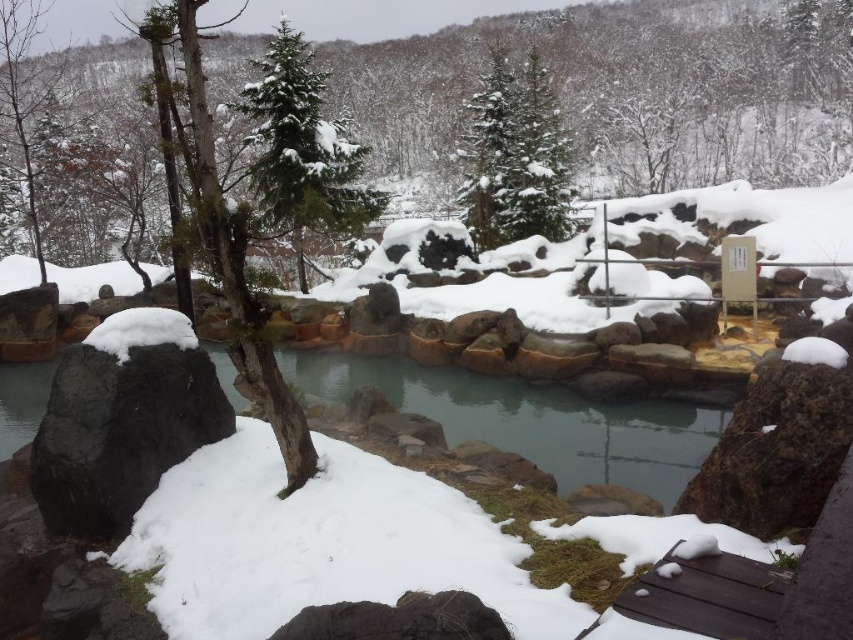
Question: Does clear water at center appear on the left side of green textured evergreen tree at upper center?

Choices:
 (A) no
 (B) yes

Answer: (B)

Question: Is green textured pine tree at upper center smaller than green textured evergreen tree at upper center?

Choices:
 (A) yes
 (B) no

Answer: (B)

Question: Is green textured pine tree at upper center smaller than green textured evergreen tree at upper center?

Choices:
 (A) no
 (B) yes

Answer: (A)

Question: Which of the following is the closest to the observer?

Choices:
 (A) (582, 426)
 (B) (251, 184)

Answer: (A)

Question: Which is farther from the clear water at center?

Choices:
 (A) green textured evergreen tree at upper center
 (B) green textured pine tree at upper center

Answer: (A)

Question: Estimate the real-world distances between objects in this image. Which object is farther from the green textured pine tree at upper center?

Choices:
 (A) clear water at center
 (B) green textured evergreen tree at upper center

Answer: (B)